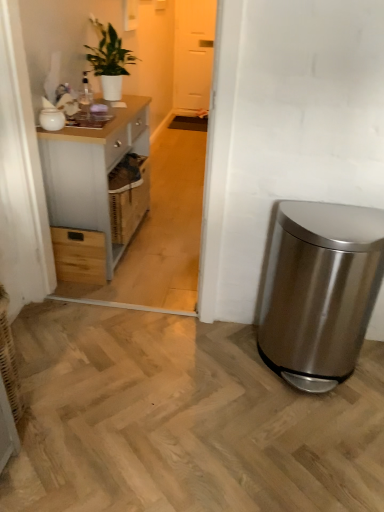
Question: Is transparent glass door at upper center taller than light gray wood cabinet at left?

Choices:
 (A) yes
 (B) no

Answer: (A)

Question: Is transparent glass door at upper center positioned in front of light gray wood cabinet at left?

Choices:
 (A) no
 (B) yes

Answer: (A)

Question: Is transparent glass door at upper center thinner than light gray wood cabinet at left?

Choices:
 (A) no
 (B) yes

Answer: (B)

Question: Is transparent glass door at upper center facing away from light gray wood cabinet at left?

Choices:
 (A) no
 (B) yes

Answer: (A)

Question: Is transparent glass door at upper center smaller than light gray wood cabinet at left?

Choices:
 (A) no
 (B) yes

Answer: (B)

Question: Is transparent glass door at upper center at the right side of light gray wood cabinet at left?

Choices:
 (A) no
 (B) yes

Answer: (B)

Question: Considering the relative sizes of stainless steel trash can at lower right and white glossy jar at upper left in the image provided, is stainless steel trash can at lower right thinner than white glossy jar at upper left?

Choices:
 (A) yes
 (B) no

Answer: (B)

Question: Is stainless steel trash can at lower right positioned behind white glossy jar at upper left?

Choices:
 (A) no
 (B) yes

Answer: (A)

Question: Does stainless steel trash can at lower right have a smaller size compared to white glossy jar at upper left?

Choices:
 (A) yes
 (B) no

Answer: (B)

Question: Could you tell me if stainless steel trash can at lower right is facing white glossy jar at upper left?

Choices:
 (A) yes
 (B) no

Answer: (B)

Question: Is stainless steel trash can at lower right not inside white glossy jar at upper left?

Choices:
 (A) yes
 (B) no

Answer: (A)

Question: Is stainless steel trash can at lower right looking in the opposite direction of white glossy jar at upper left?

Choices:
 (A) yes
 (B) no

Answer: (B)

Question: Can you confirm if light gray wood cabinet at left is positioned to the left of white glossy jar at upper left?

Choices:
 (A) yes
 (B) no

Answer: (B)